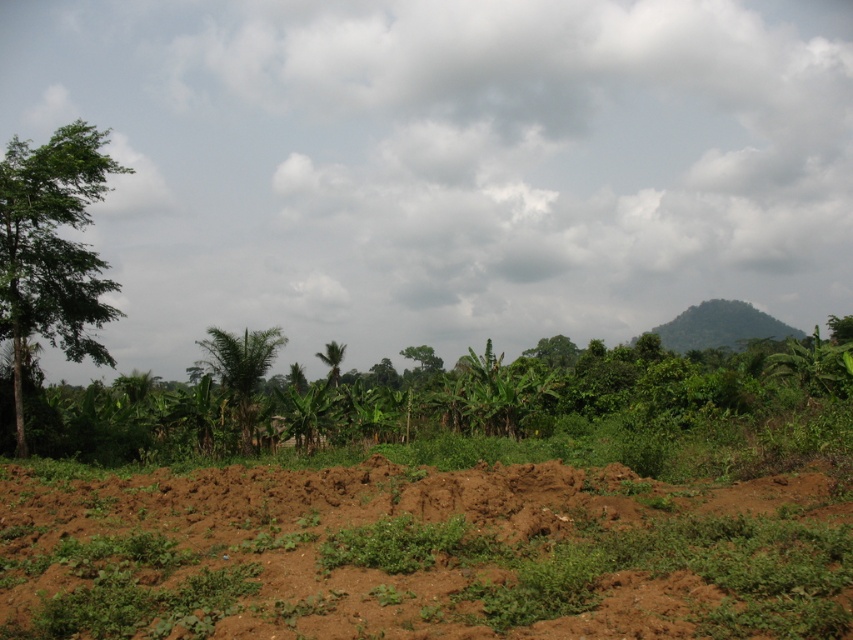
Question: Can you confirm if brown soil at lower center is wider than green leafy tree at left?

Choices:
 (A) no
 (B) yes

Answer: (B)

Question: Is brown soil at lower center thinner than green leafy palm tree at center?

Choices:
 (A) no
 (B) yes

Answer: (A)

Question: Which object is positioned closest to the green leafy palm tree at center?

Choices:
 (A) green leafy tree at left
 (B) brown soil at lower center

Answer: (A)

Question: Among these objects, which one is nearest to the camera?

Choices:
 (A) brown soil at lower center
 (B) green leafy tree at left
 (C) green leafy palm tree at center

Answer: (A)

Question: Can you confirm if green leafy tree at left is smaller than green leafy palm at center?

Choices:
 (A) yes
 (B) no

Answer: (A)

Question: Which point is farther to the camera?

Choices:
 (A) (21, 336)
 (B) (334, 349)
 (C) (215, 369)

Answer: (B)